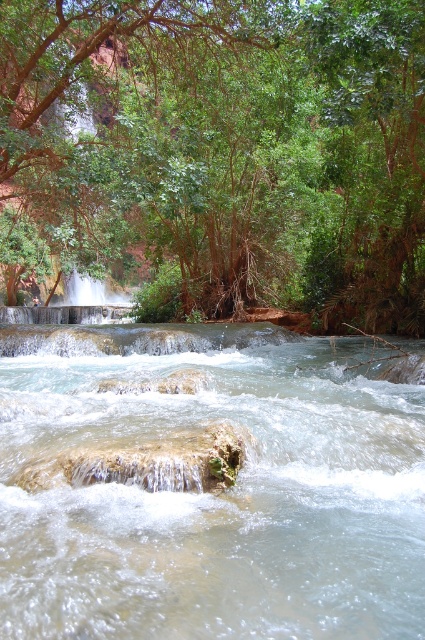
Can you confirm if clear water stream at center is positioned above green leafy tree at upper right?

Incorrect, clear water stream at center is not positioned above green leafy tree at upper right.

Who is positioned more to the right, clear water stream at center or green leafy tree at upper right?

From the viewer's perspective, green leafy tree at upper right appears more on the right side.

Is point (19, 410) less distant than point (394, 212)?

Yes, it is in front of point (394, 212).

The image size is (425, 640). Identify the location of clear water stream at center. (212, 492).

Can you confirm if green leafy tree at upper center is positioned below clear water stream at center?

No.

Does green leafy tree at upper center have a lesser width compared to clear water stream at center?

No, green leafy tree at upper center is not thinner than clear water stream at center.

Which is in front, point (74, 76) or point (399, 634)?

Point (399, 634)

Identify the location of green leafy tree at upper center. The image size is (425, 640). (218, 152).

Does green leafy tree at upper center have a lesser height compared to green leafy tree at upper right?

No.

Can you confirm if green leafy tree at upper center is bigger than green leafy tree at upper right?

Yes, green leafy tree at upper center is bigger than green leafy tree at upper right.

Identify the location of green leafy tree at upper center. The width and height of the screenshot is (425, 640). (218, 152).

Find the location of `green leafy tree at upper center`. green leafy tree at upper center is located at coordinates point(218,152).